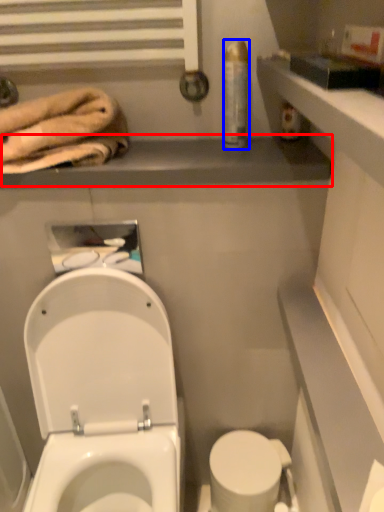
Question: Which object is further to the camera taking this photo, balustrade (highlighted by a red box) or toiletry (highlighted by a blue box)?

Choices:
 (A) balustrade
 (B) toiletry

Answer: (B)